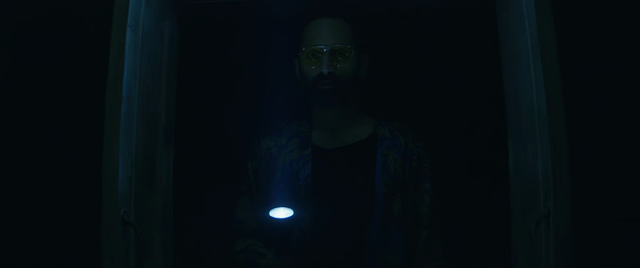
This screenshot has height=268, width=640. Identify the location of doorknob. (134, 227).